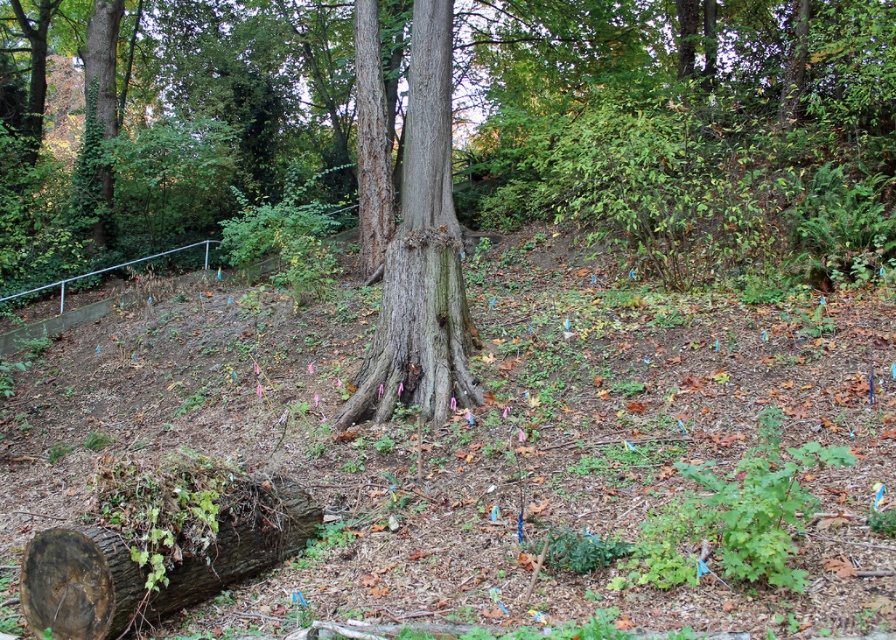
Is smooth brown tree trunk at center wider than brown rough log at lower left?

In fact, smooth brown tree trunk at center might be narrower than brown rough log at lower left.

Is smooth brown tree trunk at center in front of brown rough log at lower left?

That is False.

Is point (452, 358) closer to camera compared to point (216, 589)?

No, (452, 358) is behind (216, 589).

You are a GUI agent. You are given a task and a screenshot of the screen. Output one action in this format:
    pyautogui.click(x=<x>, y=<y>)
    Task: Click on the smooth brown tree trunk at center
    The width and height of the screenshot is (896, 640).
    Given the screenshot: What is the action you would take?
    421,256